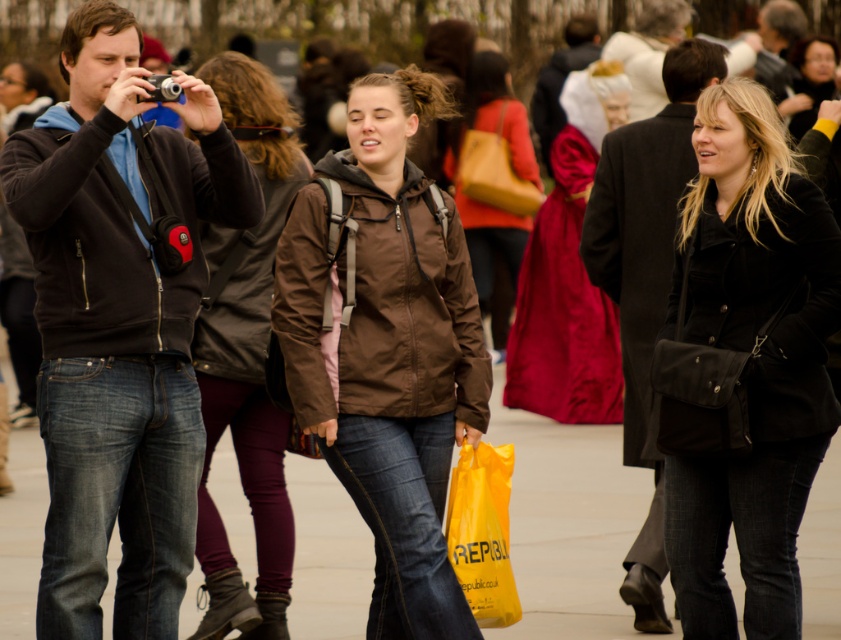
Question: Which point is closer to the camera taking this photo?

Choices:
 (A) (468, 148)
 (B) (595, 186)

Answer: (B)

Question: Is matte black jacket at left in front of black suede jacket at center?

Choices:
 (A) yes
 (B) no

Answer: (A)

Question: Which object is the closest to the smooth concrete pavement at center?

Choices:
 (A) black suede jacket at center
 (B) matte brown jacket at center
 (C) black leather coat at right
 (D) silky red dress at center

Answer: (A)

Question: Is matte black jacket at left positioned behind black leather coat at right?

Choices:
 (A) no
 (B) yes

Answer: (A)

Question: Can you confirm if black suede jacket at center is bigger than matte brown jacket at center?

Choices:
 (A) no
 (B) yes

Answer: (A)

Question: Which is farther from the black leather coat at right?

Choices:
 (A) matte black jacket at left
 (B) brown leather jacket at center

Answer: (A)